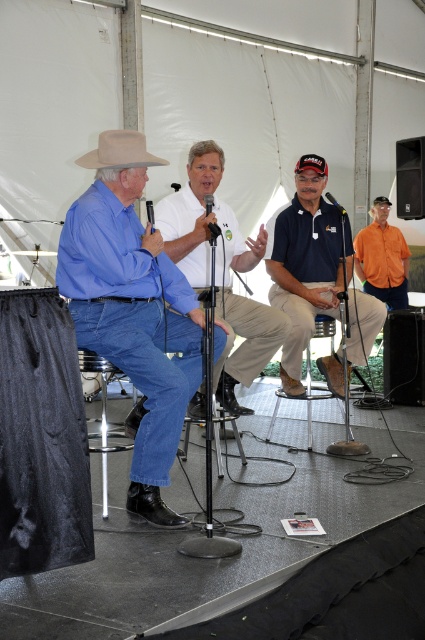
Question: Does orange cotton shirt at right have a larger size compared to metallic silver microphone at center?

Choices:
 (A) yes
 (B) no

Answer: (A)

Question: Is white cotton shirt at center smaller than black matte microphone at center?

Choices:
 (A) no
 (B) yes

Answer: (A)

Question: Can you confirm if tan felt cowboy hat at left is positioned above metallic/matte black microphone at center?

Choices:
 (A) yes
 (B) no

Answer: (A)

Question: Which object appears closest to the camera in this image?

Choices:
 (A) black matte microphone at center
 (B) tan felt cowboy hat at left
 (C) matte blue shirt at left

Answer: (B)

Question: Which of the following is the farthest from the observer?

Choices:
 (A) (107, 145)
 (B) (365, 246)
 (C) (214, 230)
 (D) (107, 195)

Answer: (B)

Question: Which point is farther to the camera?

Choices:
 (A) black matte microphone at center
 (B) navy blue shirt at center

Answer: (B)